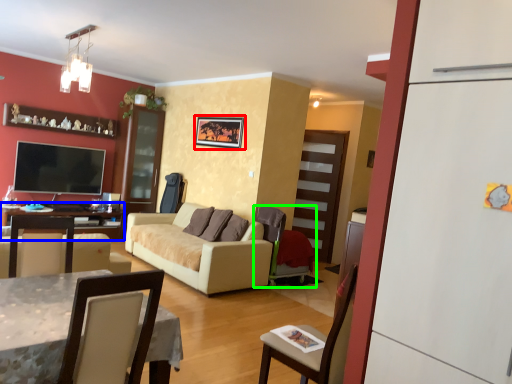
Question: Which is nearer to the picture frame (highlighted by a red box)? table (highlighted by a blue box) or chair (highlighted by a green box).

Choices:
 (A) table
 (B) chair

Answer: (B)